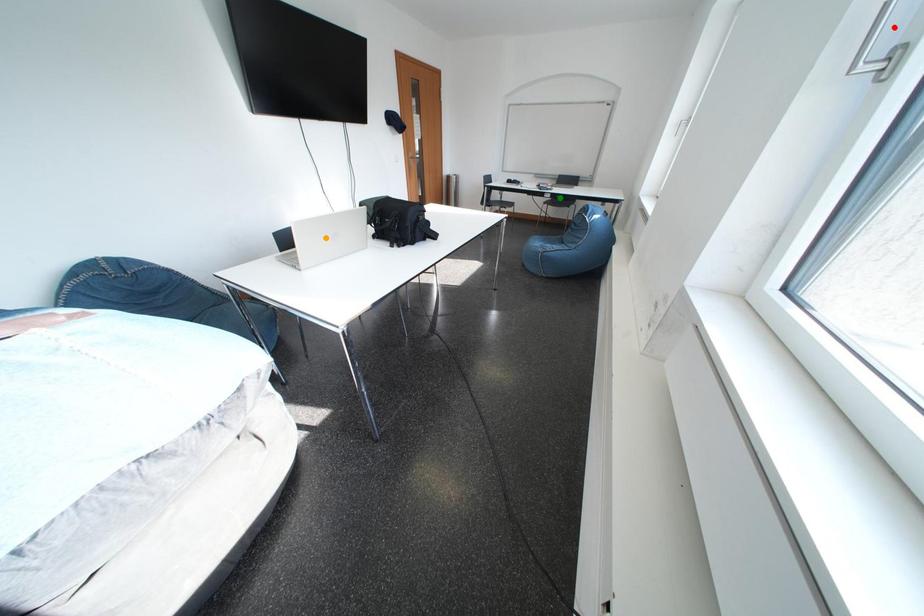
Order these from nearest to farthest:
red point, orange point, green point

red point
orange point
green point